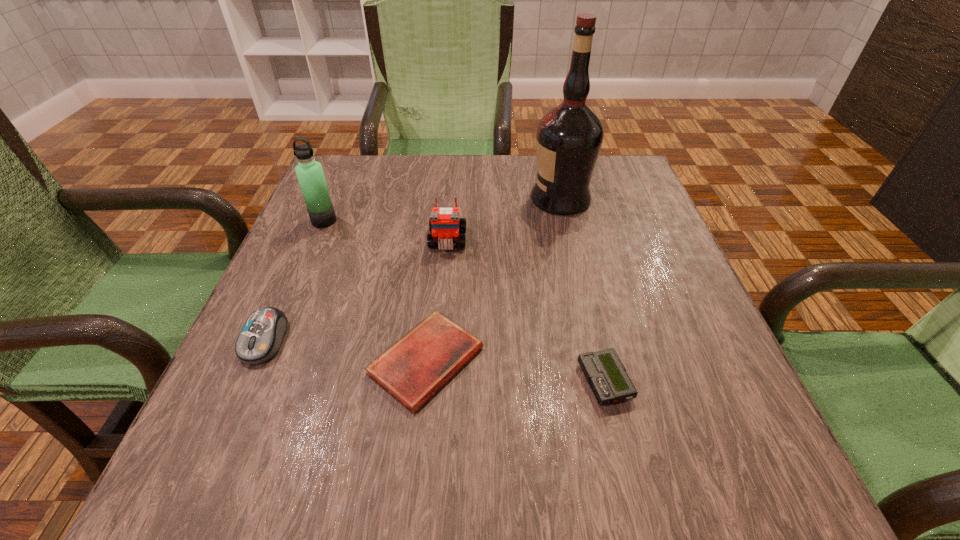
In the image, there is a desktop. Identify the location of vacant space at the near edge. The image size is (960, 540). (315, 491).

The height and width of the screenshot is (540, 960). In the image, there is a desktop. Identify the location of vacant space at the left edge. (304, 336).

Image resolution: width=960 pixels, height=540 pixels. Identify the location of vacant space at the right edge of the desktop. (621, 312).

At what (x,y) coordinates should I click in order to perform the action: click on blank space at the far left corner of the desktop. Please return your answer as a coordinate pair (x, y). Looking at the image, I should click on (364, 164).

Identify the location of vacant space in between the fifth shortest object and the fourth shortest object. (386, 231).

Image resolution: width=960 pixels, height=540 pixels. Find the location of `free space between the shortest object and the fifth shortest object`. free space between the shortest object and the fifth shortest object is located at coordinates (375, 291).

Find the location of `vacant area that lies between the liquor and the shortest object`. vacant area that lies between the liquor and the shortest object is located at coordinates (493, 280).

Image resolution: width=960 pixels, height=540 pixels. Find the location of `unoccupied area between the beeper and the second tallest object`. unoccupied area between the beeper and the second tallest object is located at coordinates (465, 301).

You are a GUI agent. You are given a task and a screenshot of the screen. Output one action in this format:
    pyautogui.click(x=<x>, y=<y>)
    Task: Click on the free area in between the third tallest object and the second shortest object
    The image size is (960, 540).
    Given the screenshot: What is the action you would take?
    pyautogui.click(x=526, y=311)

Identify the location of unoccupied area between the third shortest object and the Lego. (356, 290).